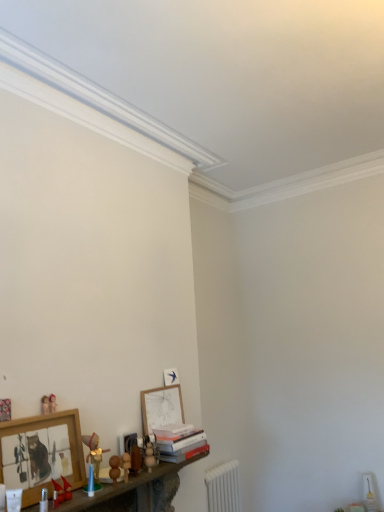
Question: Is wooden beads at lower left, which is the second toy from right to left, positioned in front of matte red toy boat at lower left, arranged as the fourth toy when viewed from the right?

Choices:
 (A) no
 (B) yes

Answer: (A)

Question: Is wooden beads at lower left, the 5th toy when ordered from left to right, outside of matte red toy boat at lower left, arranged as the fourth toy when viewed from the right?

Choices:
 (A) no
 (B) yes

Answer: (B)

Question: Can you confirm if wooden beads at lower left, the 5th toy when ordered from left to right, is bigger than matte red toy boat at lower left, which is the 3th toy from left to right?

Choices:
 (A) yes
 (B) no

Answer: (B)

Question: From the image's perspective, is wooden beads at lower left, which is the second toy from right to left, over matte red toy boat at lower left, arranged as the fourth toy when viewed from the right?

Choices:
 (A) yes
 (B) no

Answer: (A)

Question: Can you confirm if wooden beads at lower left, the 5th toy when ordered from left to right, is taller than matte red toy boat at lower left, which is the 3th toy from left to right?

Choices:
 (A) no
 (B) yes

Answer: (B)

Question: Can you confirm if wooden beads at lower left, which is the second toy from right to left, is smaller than matte red toy boat at lower left, which is the 3th toy from left to right?

Choices:
 (A) yes
 (B) no

Answer: (A)

Question: Does matte wooden figurine at lower left, acting as the fifth toy starting from the right, appear on the left side of matte wooden toy at lower left, which is counted as the first toy, starting from the left?

Choices:
 (A) no
 (B) yes

Answer: (A)

Question: Is matte wooden figurine at lower left, the 2th toy in the left-to-right sequence, not close to matte wooden toy at lower left, the sixth toy positioned from the right?

Choices:
 (A) yes
 (B) no

Answer: (B)

Question: Can you confirm if matte wooden figurine at lower left, acting as the fifth toy starting from the right, is shorter than matte wooden toy at lower left, which is counted as the first toy, starting from the left?

Choices:
 (A) no
 (B) yes

Answer: (A)

Question: Is matte wooden figurine at lower left, acting as the fifth toy starting from the right, positioned before matte wooden toy at lower left, the sixth toy positioned from the right?

Choices:
 (A) no
 (B) yes

Answer: (A)

Question: From a real-world perspective, is matte wooden figurine at lower left, acting as the fifth toy starting from the right, on matte wooden toy at lower left, which is counted as the first toy, starting from the left?

Choices:
 (A) no
 (B) yes

Answer: (B)

Question: Is matte wooden figurine at lower left, the 2th toy in the left-to-right sequence, completely or partially outside of matte wooden toy at lower left, which is counted as the first toy, starting from the left?

Choices:
 (A) no
 (B) yes

Answer: (B)

Question: Is the position of wooden toy at lower center, the 6th toy from the left, less distant than that of matte wooden figurine at lower left, acting as the fifth toy starting from the right?

Choices:
 (A) no
 (B) yes

Answer: (A)